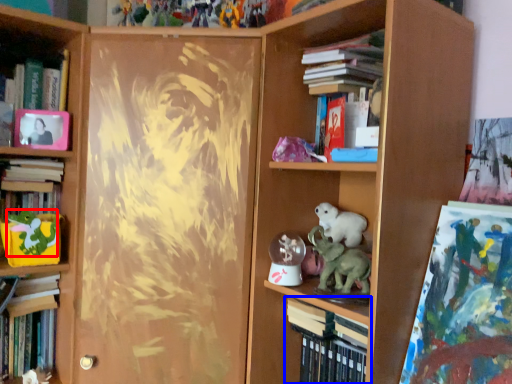
Question: Which of the following is the closest to the observer, animal (highlighted by a red box) or book (highlighted by a blue box)?

Choices:
 (A) animal
 (B) book

Answer: (B)